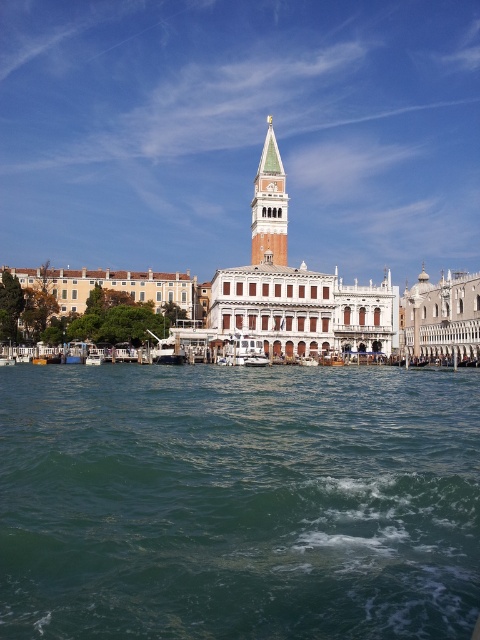
You are standing on the dock and notice the green water at center and the green marble bell tower at upper center. Which of these two objects occupies more horizontal space in the image?

The green water at center occupies more horizontal space than the green marble bell tower at upper center because its width surpasses the tower.

You are standing on the dock and see the green water at center and the white glossy boat at center. Which one is taller from your perspective?

The green water at center is taller than the white glossy boat at center.

You are a tourist in Venice and want to take a photo of the white glossy boat at center. Since the green water at center is part of the background, will the boat be fully visible in the photo?

The green water at center is larger in size than the white glossy boat at center, so the boat will be fully visible as it is smaller and positioned in the foreground.